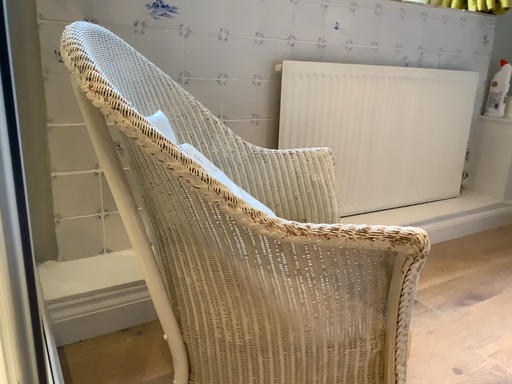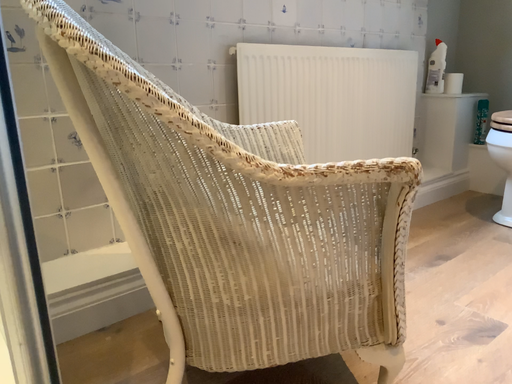
Question: How did the camera likely rotate when shooting the video?

Choices:
 (A) rotated left
 (B) rotated right

Answer: (B)